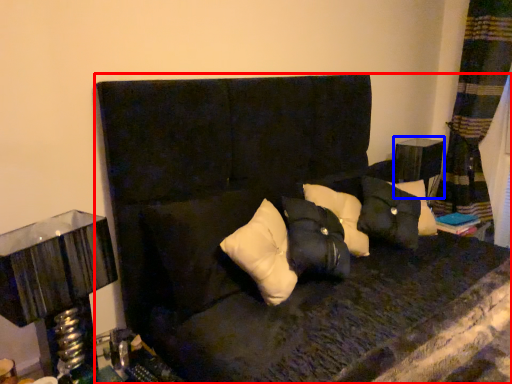
Question: Which point is closer to the camera, furniture (highlighted by a red box) or table (highlighted by a blue box)?

Choices:
 (A) furniture
 (B) table

Answer: (A)